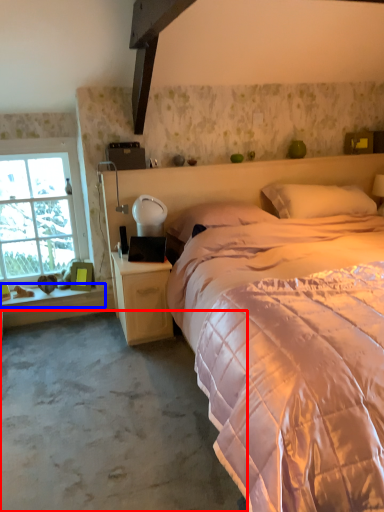
Question: Which of the following is the closest to the observer, concrete (highlighted by a red box) or window sill (highlighted by a blue box)?

Choices:
 (A) concrete
 (B) window sill

Answer: (A)